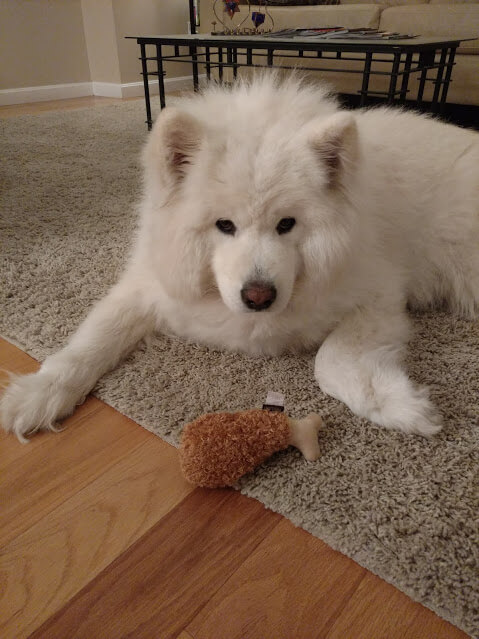
Locate an element on the screen. This screenshot has width=479, height=639. black wrought iron looking table is located at coordinates (386, 66).